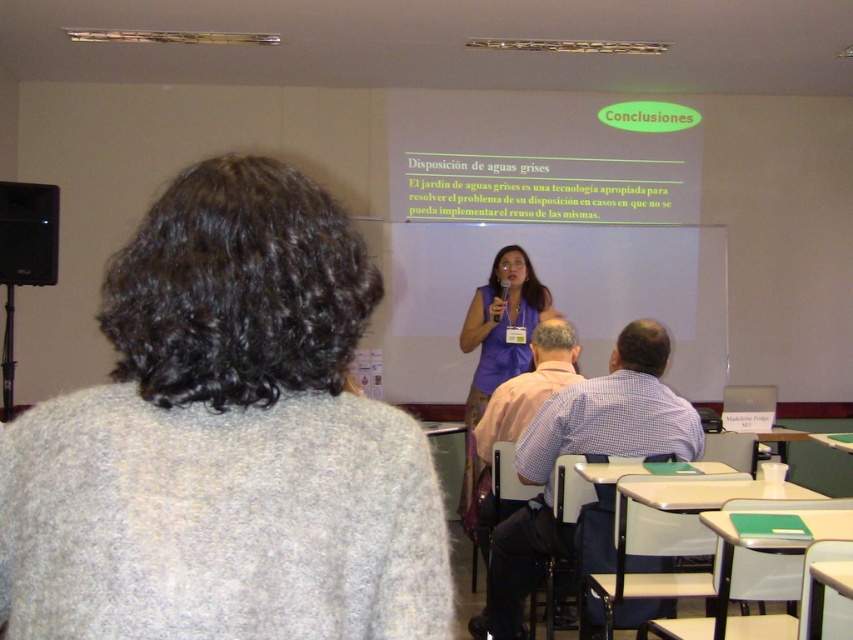
You are organizing a school event and need to decide whether to place a name tag on the checkered fabric shirt at center or the black matte speaker at left. Which object has a larger width and is better suited for displaying a name tag?

The checkered fabric shirt at center has a larger width than the black matte speaker at left, making it better suited for displaying a name tag.

You are sitting in the classroom and want to see both the purple fabric dress at center and the black matte speaker at left. Which one is positioned lower in the image?

The purple fabric dress at center is positioned lower than the black matte speaker at left in the image.